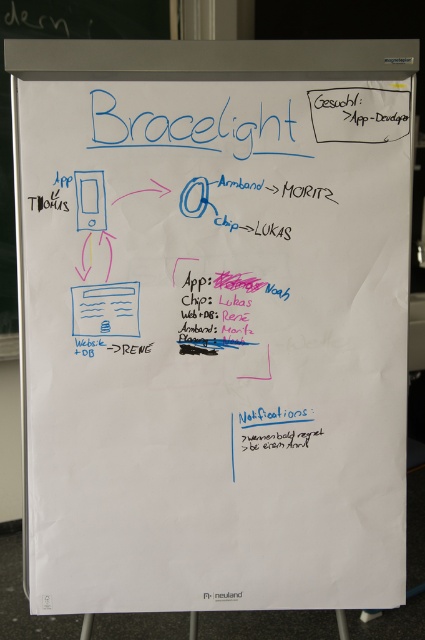
Based on the photo, which of these two, white paperboard at upper left or matte white web page at center, stands shorter?

matte white web page at center

Who is taller, white paperboard at upper left or matte white web page at center?

white paperboard at upper left

The image size is (425, 640). Identify the location of white paperboard at upper left. (10, 96).